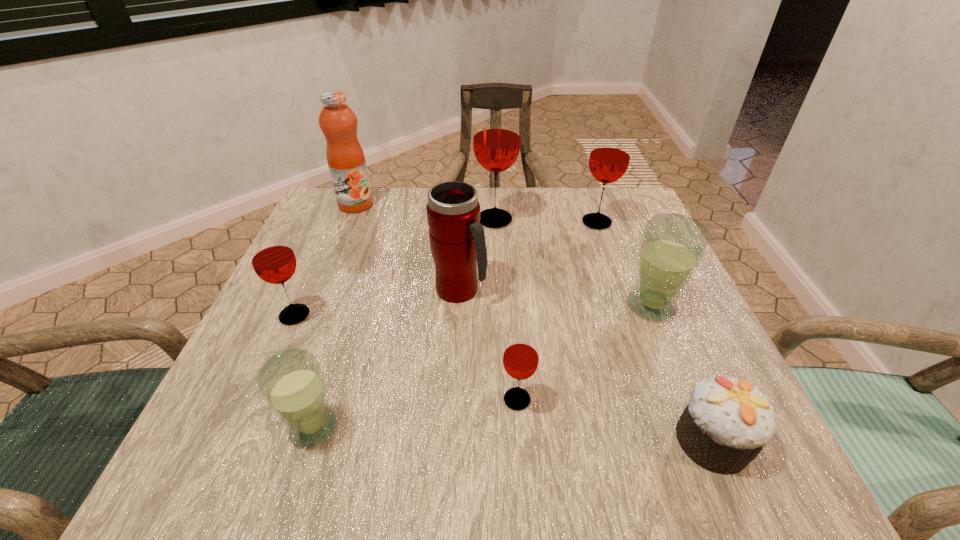
Where is `the smaller blue glass`? This screenshot has width=960, height=540. the smaller blue glass is located at coordinates (291, 382).

Identify the location of the nearer blue glass. [291, 382].

Find the location of a particular element. The width and height of the screenshot is (960, 540). cupcake is located at coordinates (727, 422).

Where is `vacant area situated on the front label of the orange fruit juice`? This screenshot has height=540, width=960. vacant area situated on the front label of the orange fruit juice is located at coordinates (345, 233).

This screenshot has height=540, width=960. I want to click on free region located on the right of the tallest glass, so click(565, 220).

I want to click on blank space located on the left of the second biggest red glass, so click(439, 222).

The height and width of the screenshot is (540, 960). Identify the location of free space located 0.250m on the side with the handle of the thermos bottle. [611, 291].

You are a GUI agent. You are given a task and a screenshot of the screen. Output one action in this format:
    pyautogui.click(x=<x>, y=<y>)
    Task: Click on the vacant region located on the back of the leftmost glass
    
    Given the screenshot: What is the action you would take?
    pyautogui.click(x=315, y=269)

Locate an element on the screen. This screenshot has width=960, height=540. vacant region located 0.140m on the left of the bigger blue glass is located at coordinates tap(552, 306).

Identify the location of free location located on the back of the nearest red glass. (510, 293).